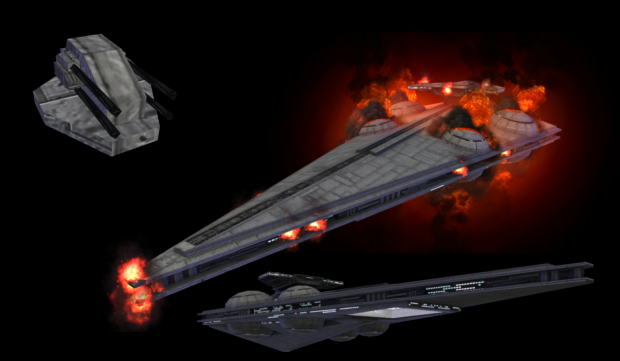
The image size is (620, 361). In order to click on mirror in this screenshot , I will do `click(396, 312)`.